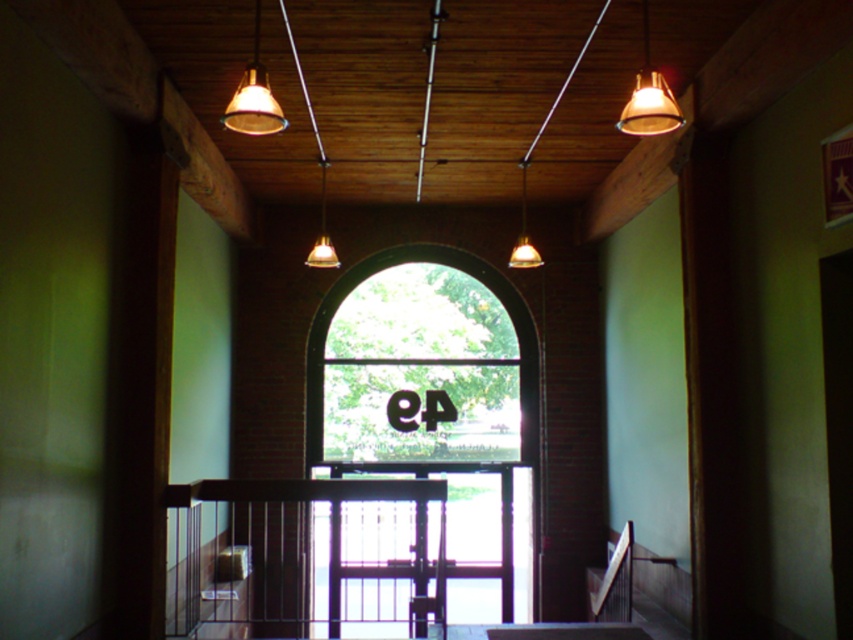
Is transparent glass window at center to the right of matte gold pendant light at center from the viewer's perspective?

No, transparent glass window at center is not to the right of matte gold pendant light at center.

What do you see at coordinates (422, 442) in the screenshot?
I see `transparent glass window at center` at bounding box center [422, 442].

The height and width of the screenshot is (640, 853). I want to click on transparent glass window at center, so click(422, 442).

Is matte glass light at upper center to the right of matte gold pendant light at center from the viewer's perspective?

Yes, matte glass light at upper center is to the right of matte gold pendant light at center.

Between point (653, 92) and point (525, 212), which one is positioned behind?

The point (525, 212) is more distant.

Find the location of `matte glass light at upper center`. matte glass light at upper center is located at coordinates click(x=648, y=106).

How distant is transparent glass window at center from black metal balustrade at lower center?

14.32 feet

Is transparent glass window at center positioned before black metal balustrade at lower center?

No, transparent glass window at center is behind black metal balustrade at lower center.

Between point (456, 564) and point (202, 531), which one is positioned in front?

Positioned in front is point (202, 531).

You are a GUI agent. You are given a task and a screenshot of the screen. Output one action in this format:
    pyautogui.click(x=<x>, y=<y>)
    Task: Click on the transparent glass window at center
    
    Given the screenshot: What is the action you would take?
    pyautogui.click(x=422, y=442)